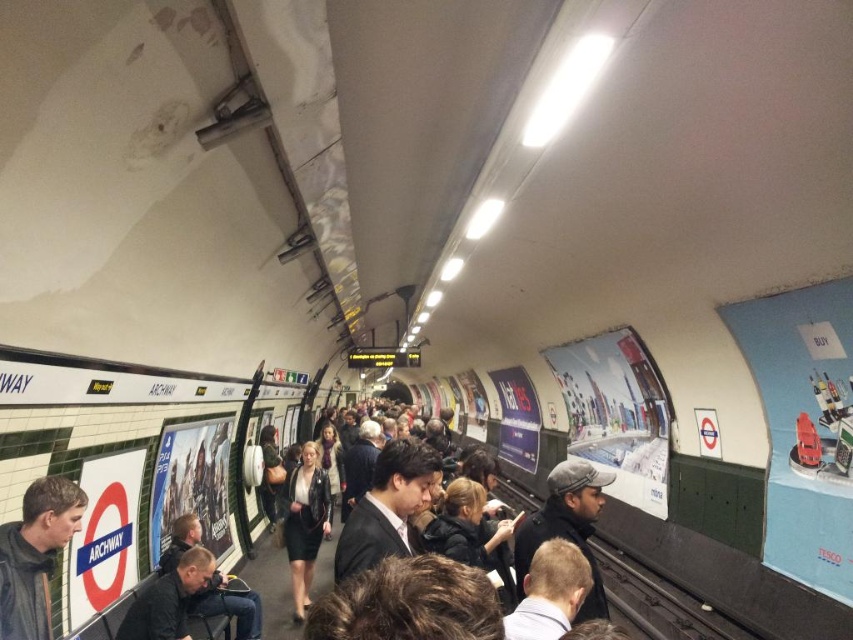
You are standing on the platform at the ARCHWAY underground station and notice a dark gray jacket at lower left. Where exactly is the dark gray jacket located in relation to the other objects on the platform?

The dark gray jacket at lower left is located at point coordinates of 0.867 on the x axis and 0.042 on the y axis.

You are a commuter waiting on the platform and see a person wearing a dark suit at center and a dark gray wool hat at center. Which item is positioned to the left?

The dark suit at center is to the left of the dark gray wool hat at center.

You are standing on the platform at the ARCHWAY station and notice two points marked on the ceiling. The first point is at coordinate point (47, 480) and the second is at point (350, 513). Which point is closer to your eyes?

Point (47, 480) is closer to the camera than point (350, 513).